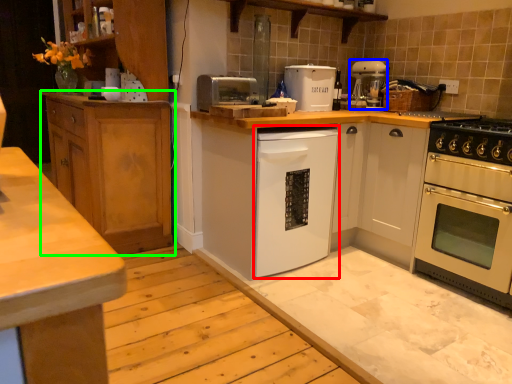
Question: Estimate the real-world distances between objects in this image. Which object is farther from dish washer (highlighted by a red box), coffee machine (highlighted by a blue box) or cabinetry (highlighted by a green box)?

Choices:
 (A) coffee machine
 (B) cabinetry

Answer: (A)